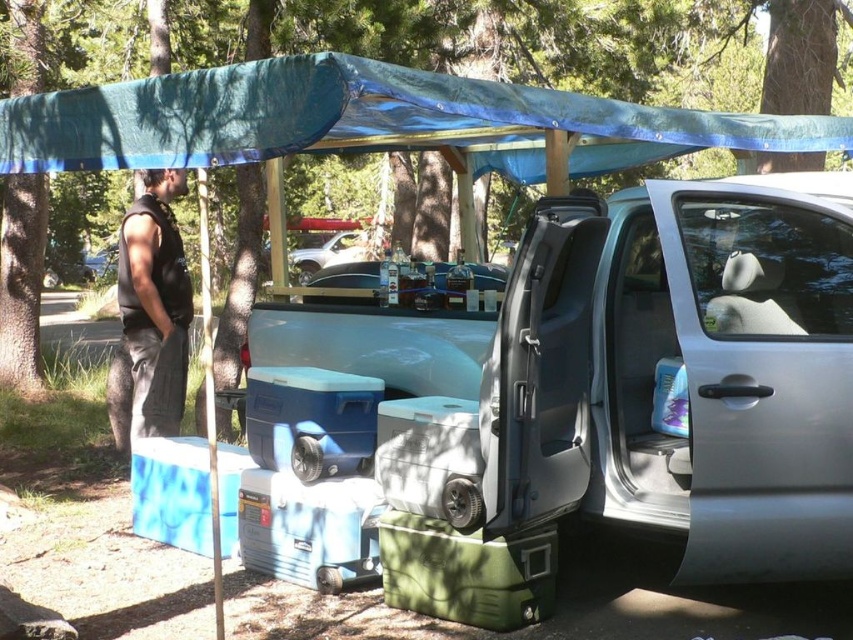
Question: Which point is closer to the camera?

Choices:
 (A) satin silver minivan at center
 (B) metallic silver car at center
 (C) black sleeveless shirt at left
 (D) blue tarpaulin at upper center

Answer: (D)

Question: Is satin silver minivan at center above black sleeveless shirt at left?

Choices:
 (A) no
 (B) yes

Answer: (A)

Question: Estimate the real-world distances between objects in this image. Which object is farther from the black sleeveless shirt at left?

Choices:
 (A) satin silver minivan at center
 (B) blue tarpaulin at upper center

Answer: (A)

Question: Considering the relative positions of satin silver minivan at center and metallic silver car at center in the image provided, where is satin silver minivan at center located with respect to metallic silver car at center?

Choices:
 (A) right
 (B) left

Answer: (A)

Question: Which point is closer to the camera?

Choices:
 (A) (370, 237)
 (B) (231, 68)
 (C) (764, 218)
 (D) (152, 291)

Answer: (B)

Question: Is satin silver minivan at center to the left of metallic silver car at center from the viewer's perspective?

Choices:
 (A) no
 (B) yes

Answer: (A)